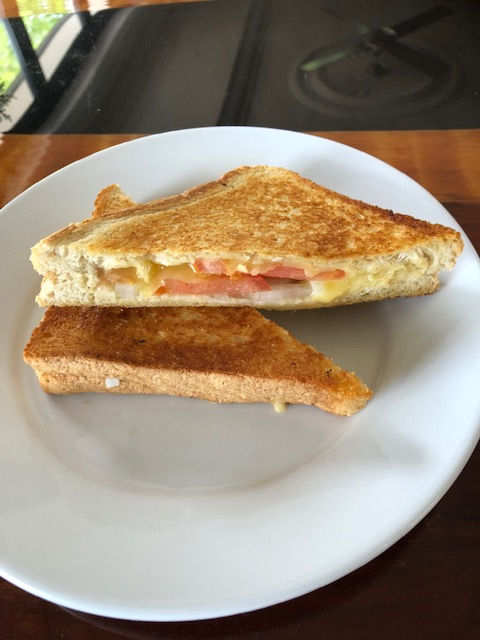
Where is `right hand side of white plate`? The image size is (480, 640). right hand side of white plate is located at coordinates (477, 260).